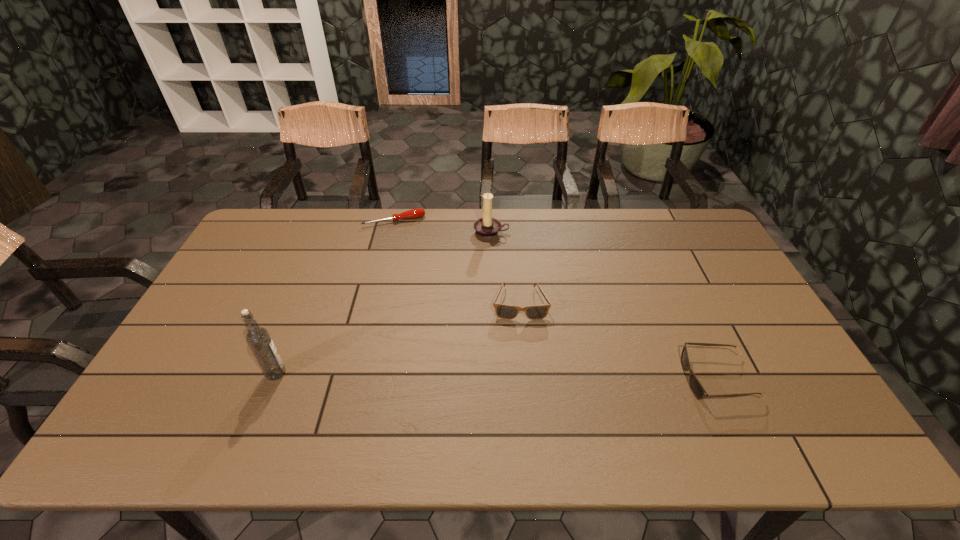
Locate an element on the screen. vacant space at the left edge is located at coordinates (242, 336).

At what (x,y) coordinates should I click in order to perform the action: click on blank space at the right edge of the desktop. Please return your answer as a coordinate pair (x, y). The image size is (960, 540). Looking at the image, I should click on (743, 283).

At what (x,y) coordinates should I click in order to perform the action: click on free point at the far left corner. Please return your answer as a coordinate pair (x, y). This screenshot has width=960, height=540. Looking at the image, I should click on (249, 238).

Identify the location of vacant space that is in between the tallest object and the left sunglasses. The width and height of the screenshot is (960, 540). (398, 338).

This screenshot has width=960, height=540. Find the location of `free spot between the shortest object and the vodka`. free spot between the shortest object and the vodka is located at coordinates (335, 297).

Find the location of a particular element. Image resolution: width=960 pixels, height=540 pixels. free spot between the fourth shortest object and the shortest object is located at coordinates (443, 226).

You are a GUI agent. You are given a task and a screenshot of the screen. Output one action in this format:
    pyautogui.click(x=<x>, y=<y>)
    Task: Click on the free space between the screwdriver and the third farthest object
    This screenshot has height=540, width=960.
    Given the screenshot: What is the action you would take?
    pyautogui.click(x=457, y=262)

Identify the location of free space between the left sunglasses and the leftmost object. The image size is (960, 540). coord(398,338).

At what (x,y) coordinates should I click in order to perform the action: click on vacant point located between the tallest object and the fourth shortest object. Please return your answer as a coordinate pair (x, y). This screenshot has width=960, height=540. Looking at the image, I should click on (384, 302).

Identify the location of vacant area that lies between the candle holder and the screwdriver. (443, 226).